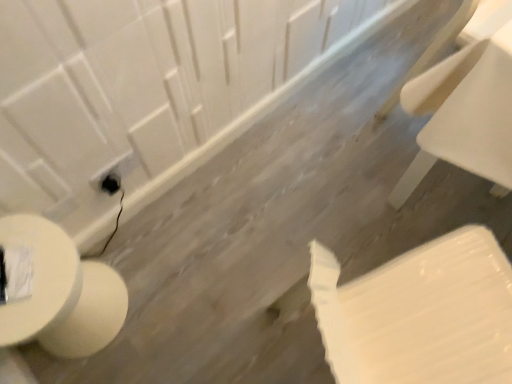
Question: Considering the positions of white glossy toilet at lower left and white glossy toilet paper at lower right in the image, is white glossy toilet at lower left taller or shorter than white glossy toilet paper at lower right?

Choices:
 (A) tall
 (B) short

Answer: (B)

Question: From the image's perspective, is white glossy toilet at lower left located above or below white glossy toilet paper at lower right?

Choices:
 (A) above
 (B) below

Answer: (A)

Question: Estimate the real-world distances between objects in this image. Which object is closer to the white glossy toilet paper at lower right?

Choices:
 (A) white glossy toilet at lower left
 (B) white plastic chair at upper right
 (C) black plastic electric outlet at lower left

Answer: (B)

Question: Based on their relative distances, which object is nearer to the white glossy toilet paper at lower right?

Choices:
 (A) black plastic electric outlet at lower left
 (B) white glossy toilet at lower left
 (C) white plastic chair at upper right

Answer: (C)